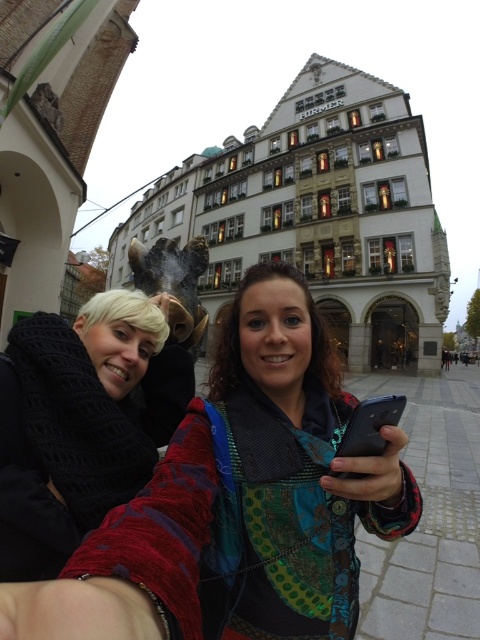
You are a photographer trying to capture a closeup of the black knitted scarf at left and the black glossy smartphone at lower center in the image. Which object should you zoom in on to ensure both are in focus without moving the camera?

You should zoom in on the black knitted scarf at left because it is larger than the black glossy smartphone at lower center, so focusing on the larger object will help both remain in focus.